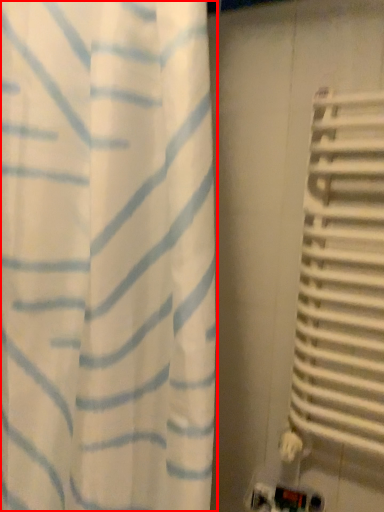
Question: Where is curtain (annotated by the red box) located in relation to blind in the image?

Choices:
 (A) left
 (B) right

Answer: (A)